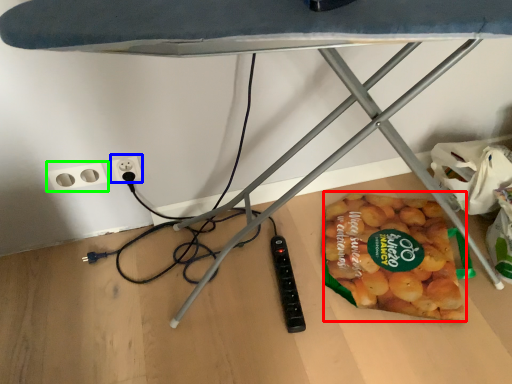
Question: Which object is the closest to the snack (highlighted by a red box)? Choose among these: electric outlet (highlighted by a blue box) or socket (highlighted by a green box).

Choices:
 (A) electric outlet
 (B) socket

Answer: (A)